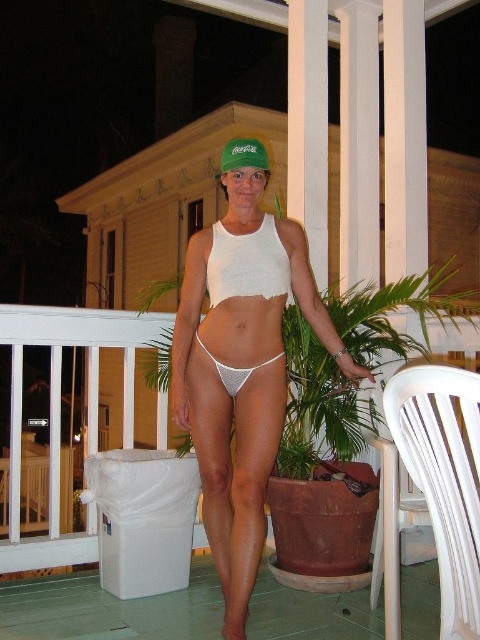
Between point (252, 205) and point (55, 484), which one is positioned in front?

Positioned in front is point (252, 205).

Is point (285, 369) positioned behind point (13, 412)?

No, it is in front of (13, 412).

Who is more distant from viewer, (x=191, y=332) or (x=8, y=528)?

Point (x=8, y=528)

Find the location of `white matte bikini bottom at center`. white matte bikini bottom at center is located at coordinates (241, 371).

Is white plastic chair at lower right above green fabric cap at center?

Actually, white plastic chair at lower right is below green fabric cap at center.

Who is higher up, white plastic chair at lower right or green fabric cap at center?

green fabric cap at center

Does point (15, 456) come in front of point (242, 157)?

No, (15, 456) is further to viewer.

The width and height of the screenshot is (480, 640). Find the location of `white plastic chair at lower right`. white plastic chair at lower right is located at coordinates (59, 413).

Can you confirm if white matte bikini bottom at center is bigger than white mesh bikini at center?

Correct, white matte bikini bottom at center is larger in size than white mesh bikini at center.

Can you confirm if white matte bikini bottom at center is wider than white mesh bikini at center?

Indeed, white matte bikini bottom at center has a greater width compared to white mesh bikini at center.

You are a GUI agent. You are given a task and a screenshot of the screen. Output one action in this format:
    pyautogui.click(x=<x>, y=<y>)
    Task: Click on the white matte bikini bottom at center
    
    Given the screenshot: What is the action you would take?
    pyautogui.click(x=241, y=371)